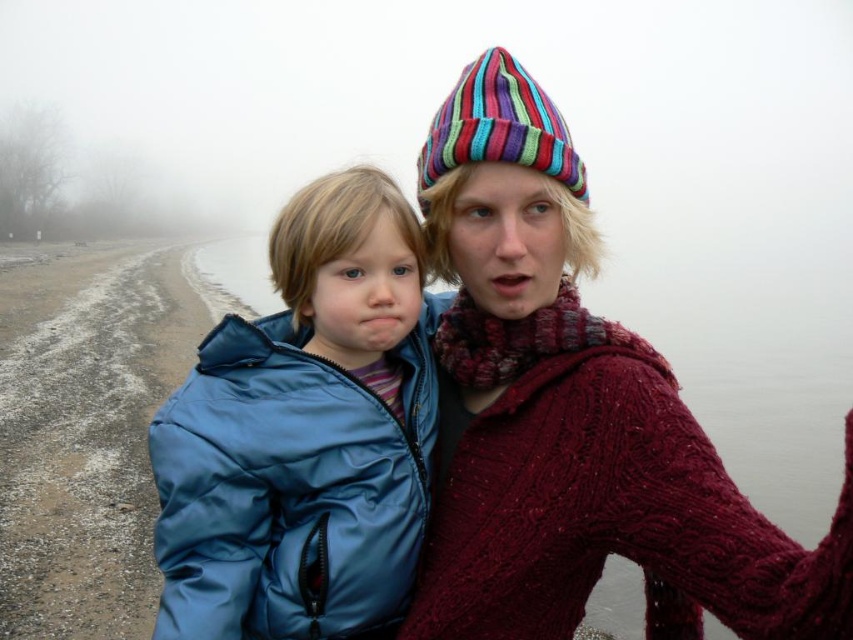
Question: Which point is closer to the camera taking this photo?

Choices:
 (A) (480, 96)
 (B) (401, 564)
 (C) (842, 497)

Answer: (C)

Question: Is knitted maroon sweater at center closer to the viewer compared to multicolored knitted beanie at upper center?

Choices:
 (A) yes
 (B) no

Answer: (A)

Question: Considering the real-world distances, which object is closest to the multicolored knitted beanie at upper center?

Choices:
 (A) blue puffy jacket at left
 (B) knitted maroon sweater at center

Answer: (B)

Question: Among these points, which one is farthest from the camera?

Choices:
 (A) (465, 118)
 (B) (285, 588)
 (C) (628, 452)

Answer: (A)

Question: Can you confirm if knitted maroon sweater at center is positioned to the left of multicolored knitted beanie at upper center?

Choices:
 (A) yes
 (B) no

Answer: (B)

Question: Is blue puffy jacket at left further to camera compared to multicolored knitted beanie at upper center?

Choices:
 (A) yes
 (B) no

Answer: (B)